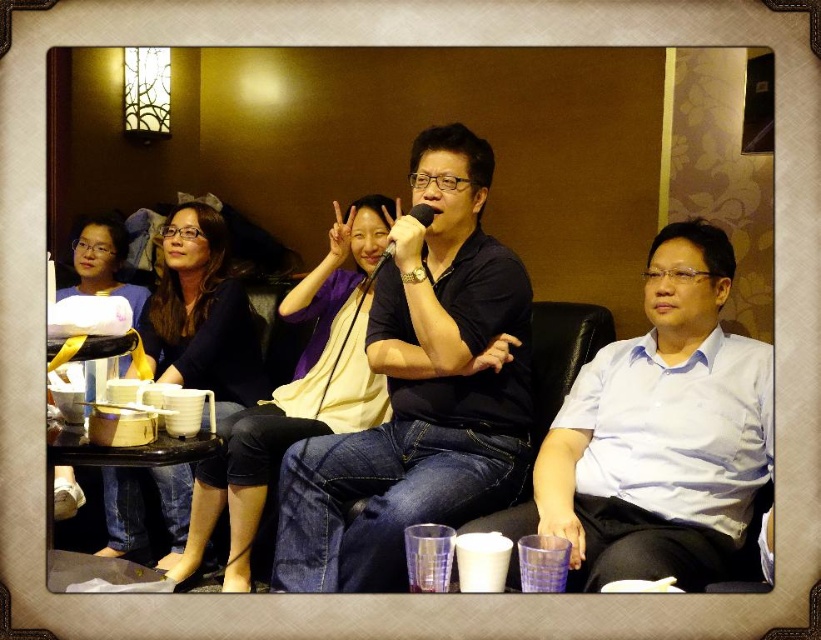
From the picture: Does matte black shirt at center lie in front of matte black shirt at upper left?

That is True.

Measure the distance between matte black shirt at center and camera.

matte black shirt at center and camera are 6.68 feet apart.

Where is `matte black shirt at center`? This screenshot has width=821, height=640. matte black shirt at center is located at coordinates (296, 394).

Is black matte shirt at center to the right of matte black shirt at upper left from the viewer's perspective?

Correct, you'll find black matte shirt at center to the right of matte black shirt at upper left.

Is point (432, 458) closer to viewer compared to point (122, 477)?

Yes, point (432, 458) is closer to viewer.

The height and width of the screenshot is (640, 821). I want to click on black matte shirt at center, so click(x=420, y=390).

Between light blue shirt at center and matte black shirt at upper left, which one appears on the left side from the viewer's perspective?

matte black shirt at upper left

Does point (686, 547) come closer to viewer compared to point (214, 220)?

Yes, point (686, 547) is in front of point (214, 220).

Identify the location of light blue shirt at center. (658, 435).